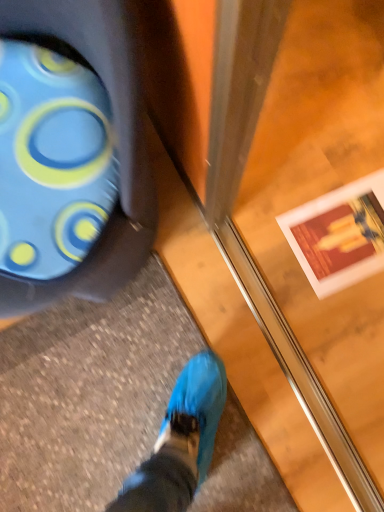
Question: Considering the relative sizes of blue rubber boot at lower left and transparent glass screen door at center in the image provided, is blue rubber boot at lower left shorter than transparent glass screen door at center?

Choices:
 (A) no
 (B) yes

Answer: (B)

Question: Could you tell me if blue rubber boot at lower left is turned towards transparent glass screen door at center?

Choices:
 (A) no
 (B) yes

Answer: (A)

Question: Is transparent glass screen door at center surrounded by blue rubber boot at lower left?

Choices:
 (A) yes
 (B) no

Answer: (B)

Question: Is blue rubber boot at lower left behind transparent glass screen door at center?

Choices:
 (A) yes
 (B) no

Answer: (A)

Question: Is blue rubber boot at lower left positioned with its back to transparent glass screen door at center?

Choices:
 (A) yes
 (B) no

Answer: (B)

Question: Considering the relative positions of blue rubber boot at lower left and transparent glass screen door at center in the image provided, is blue rubber boot at lower left to the right of transparent glass screen door at center from the viewer's perspective?

Choices:
 (A) no
 (B) yes

Answer: (A)

Question: From a real-world perspective, is transparent glass screen door at center physically below blue rubber boot at lower left?

Choices:
 (A) no
 (B) yes

Answer: (A)

Question: Is the position of transparent glass screen door at center more distant than that of blue rubber boot at lower left?

Choices:
 (A) no
 (B) yes

Answer: (A)

Question: Is transparent glass screen door at center to the left of blue rubber boot at lower left from the viewer's perspective?

Choices:
 (A) yes
 (B) no

Answer: (B)

Question: Does transparent glass screen door at center turn towards blue rubber boot at lower left?

Choices:
 (A) yes
 (B) no

Answer: (A)

Question: Is transparent glass screen door at center to the right of blue rubber boot at lower left from the viewer's perspective?

Choices:
 (A) yes
 (B) no

Answer: (A)

Question: Does transparent glass screen door at center contain blue rubber boot at lower left?

Choices:
 (A) no
 (B) yes

Answer: (A)

Question: Considering the positions of transparent glass screen door at center and blue rubber boot at lower left in the image, is transparent glass screen door at center taller or shorter than blue rubber boot at lower left?

Choices:
 (A) tall
 (B) short

Answer: (A)